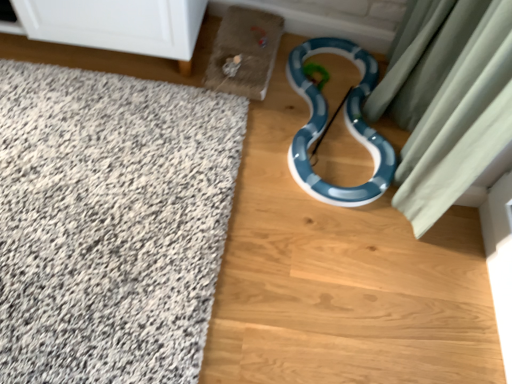
Question: Considering their positions, is white shaggy bath mat at left located in front of or behind blue glossy snake at center?

Choices:
 (A) behind
 (B) front

Answer: (B)

Question: From the image's perspective, relative to blue glossy snake at center, is white shaggy bath mat at left above or below?

Choices:
 (A) below
 (B) above

Answer: (A)

Question: Which is nearer to the white shaggy bath mat at left?

Choices:
 (A) blue glossy dirt track at center-right
 (B) blue glossy snake at center
 (C) white glossy cabinet at upper left

Answer: (A)

Question: Which of these objects is positioned farthest from the blue glossy snake at center?

Choices:
 (A) white shaggy bath mat at left
 (B) white glossy cabinet at upper left
 (C) blue glossy dirt track at center-right

Answer: (B)